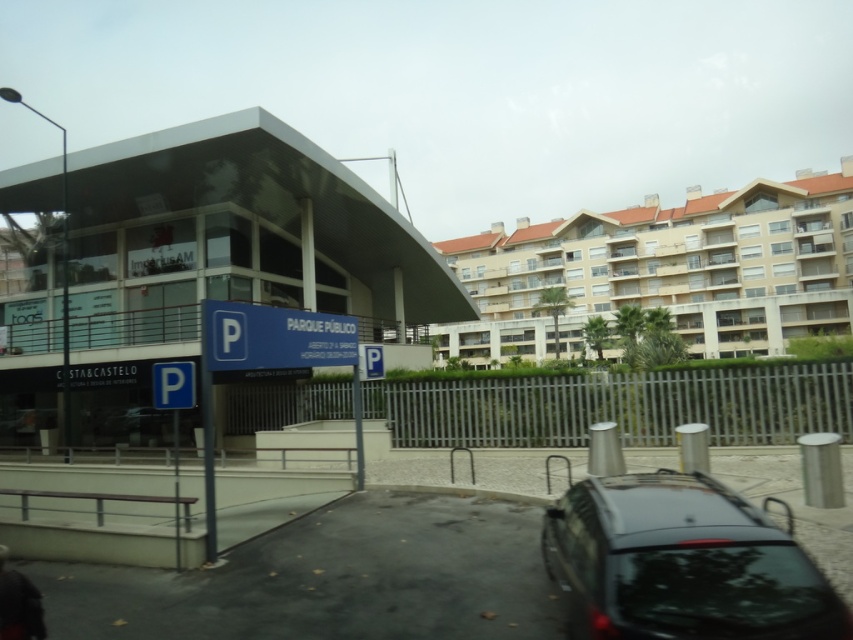
Question: Estimate the real-world distances between objects in this image. Which object is farther from the blue plastic parking sign at center?

Choices:
 (A) shiny black car at lower right
 (B) blue metallic sign at center

Answer: (A)

Question: Which point is farther from the camera taking this photo?

Choices:
 (A) (173, 401)
 (B) (335, 316)

Answer: (B)

Question: Is transparent glass building at center thinner than shiny black car at lower right?

Choices:
 (A) yes
 (B) no

Answer: (B)

Question: Which object is the closest to the blue metallic sign at center?

Choices:
 (A) transparent glass building at center
 (B) beige concrete building at upper right

Answer: (A)

Question: Can you confirm if shiny black car at lower right is positioned below blue metallic sign at center?

Choices:
 (A) no
 (B) yes

Answer: (B)

Question: Can you confirm if blue metallic sign at center is smaller than blue plastic parking sign at center?

Choices:
 (A) no
 (B) yes

Answer: (B)